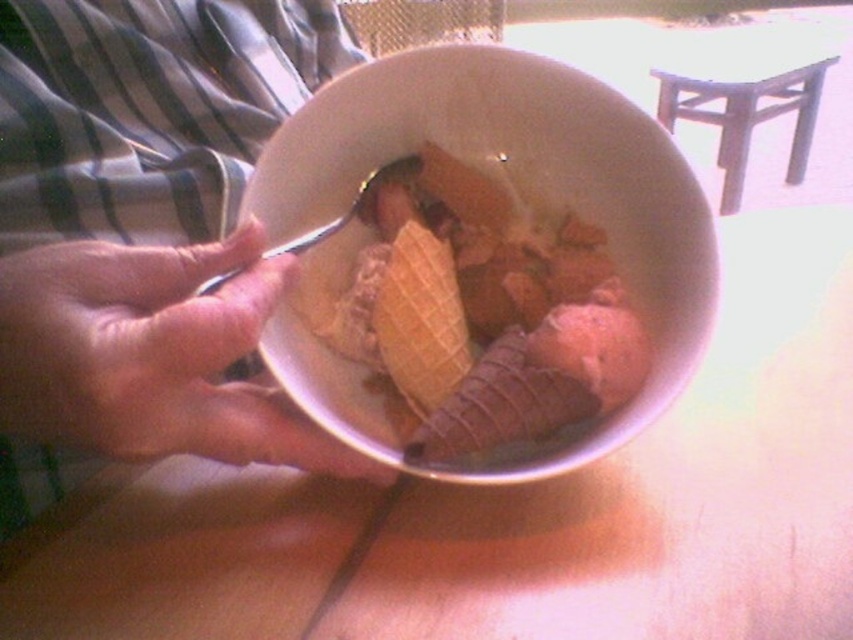
You are setting up a picnic and have a small plate that can only hold items smaller than the white matte bowl at center. Can you place the wooden stool at upper center on the plate?

The wooden stool at upper center is larger than the white matte bowl at center, so it cannot fit on the small plate designed for items smaller than the bowl.

You are a chef observing a person holding a bowl. Based on the scene, can you determine the position of the white matte bowl at center relative to the smooth skin hand at center?

The white matte bowl at center is located above the smooth skin hand at center.

Consider the image. You are a chef trying to reach the spoon inside the white matte bowl at center while holding the smooth skin hand at center. Can you comfortably grab the spoon without moving your hand?

The white matte bowl at center and smooth skin hand at center are 3.13 inches apart, so you can comfortably grab the spoon without moving your hand since the distance allows enough space to maneuver.